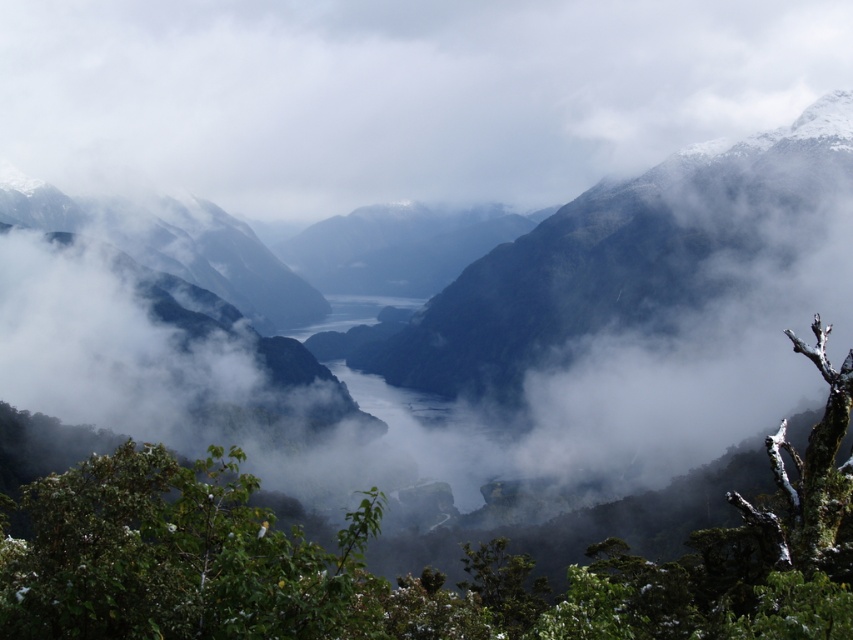
You are a photographer trying to capture the mountain landscape. You notice the white fluffy cloud at center and the green leafy tree at center in your viewfinder. Which object takes up more space in the frame?

The white fluffy cloud at center is larger in size than the green leafy tree at center, so it takes up more space in the frame.

You are an airplane pilot flying over the mountainous landscape. You notice a white fluffy cloud at center and a green leafy tree at center. Which object is taller from your perspective?

The white fluffy cloud at center is taller than the green leafy tree at center according to the description.

From the picture: You are an airplane pilot flying at an altitude of 1000 meters. You observe the white fluffy cloud at center from your cockpit. Based on its 2D coordinates, can you determine if the cloud is directly ahead of your current position?

The white fluffy cloud at center is located at coordinates (395, 93), which corresponds to the center of the image. Since the pilot is looking forward, the cloud is directly ahead in the 2D plane.